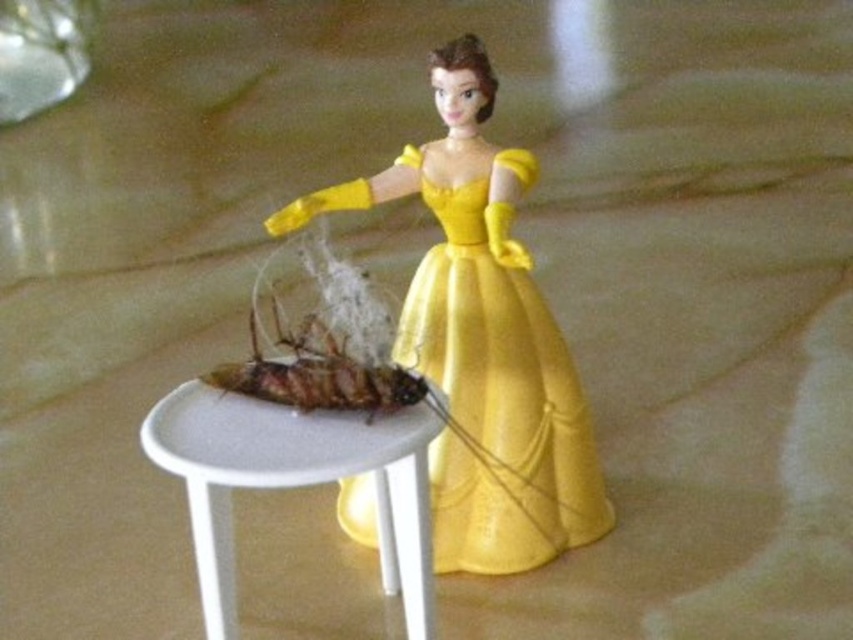
You are a photographer trying to capture a closeup of the cockroach model on the table. You notice two points marked on your camera screen at coordinates point (519, 248) and point (402, 490). Which point should you focus on to ensure the cockroach model is in sharp focus?

You should focus on point (402, 490) because point (519, 248) is behind it, meaning the cockroach model is closer to the camera at point (402, 490).

Consider the image. You are a photographer setting up a shot of the yellow satin dress at center. You need to place a small LED light at point (496, 387). Will the light be placed directly under the yellow satin dress at center?

Yes, the point (496, 387) marks the yellow satin dress at center, so placing the LED light there will position it directly under the yellow satin dress at center.

Consider the image. You are a collector of miniature figurines and you have a display case that can only accommodate items up to 15 centimeters in height. You have the yellow satin dress at center and the white plastic table at center. Which item might not fit in the display case and why?

The yellow satin dress at center is larger in size than the white plastic table at center, so it might not fit in the display case designed for items up to 15 centimeters in height.